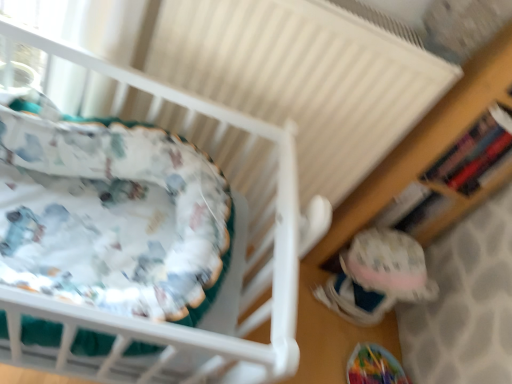
Identify the location of free space in front of fuzzy fabric toy at lower right. (316, 340).